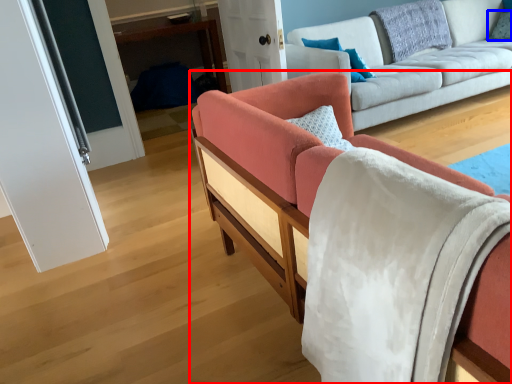
Question: Which point is further to the camera, studio couch (highlighted by a red box) or pillow (highlighted by a blue box)?

Choices:
 (A) studio couch
 (B) pillow

Answer: (B)